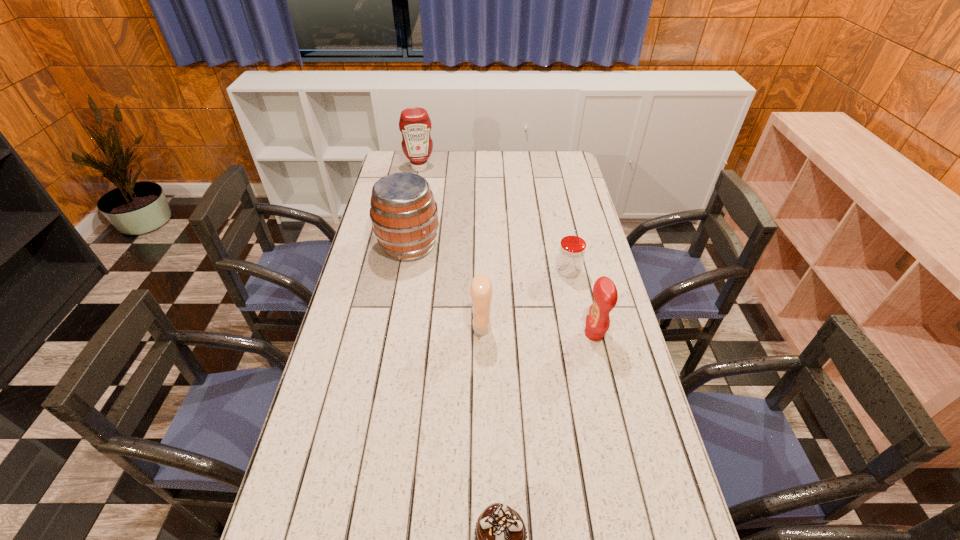
Locate an element on the screen. the leftmost condiment is located at coordinates (414, 123).

Identify the location of the farthest condiment. Image resolution: width=960 pixels, height=540 pixels. (414, 123).

Identify the location of cider. (403, 212).

You are a GUI agent. You are given a task and a screenshot of the screen. Output one action in this format:
    pyautogui.click(x=<x>, y=<y>)
    Task: Click on the rightmost condiment
    This screenshot has width=960, height=540.
    Given the screenshot: What is the action you would take?
    pyautogui.click(x=605, y=294)

I want to click on the second condiment from right to left, so click(481, 292).

What are the coordinates of `jar` in the screenshot? It's located at [x=571, y=253].

Locate an element on the screen. This screenshot has height=540, width=960. vacant space located on the front of the tallest condiment is located at coordinates (418, 179).

Find the location of `vacant space located 0.330m on the back of the cider`. vacant space located 0.330m on the back of the cider is located at coordinates (420, 182).

This screenshot has height=540, width=960. Identify the location of free space located 0.060m on the label side of the rightmost condiment. (564, 334).

You are a GUI agent. You are given a task and a screenshot of the screen. Output one action in this format:
    pyautogui.click(x=<x>, y=<y>)
    Task: Click on the vacant space located on the label side of the rightmost condiment
    This screenshot has height=540, width=960.
    Given the screenshot: What is the action you would take?
    pyautogui.click(x=561, y=334)